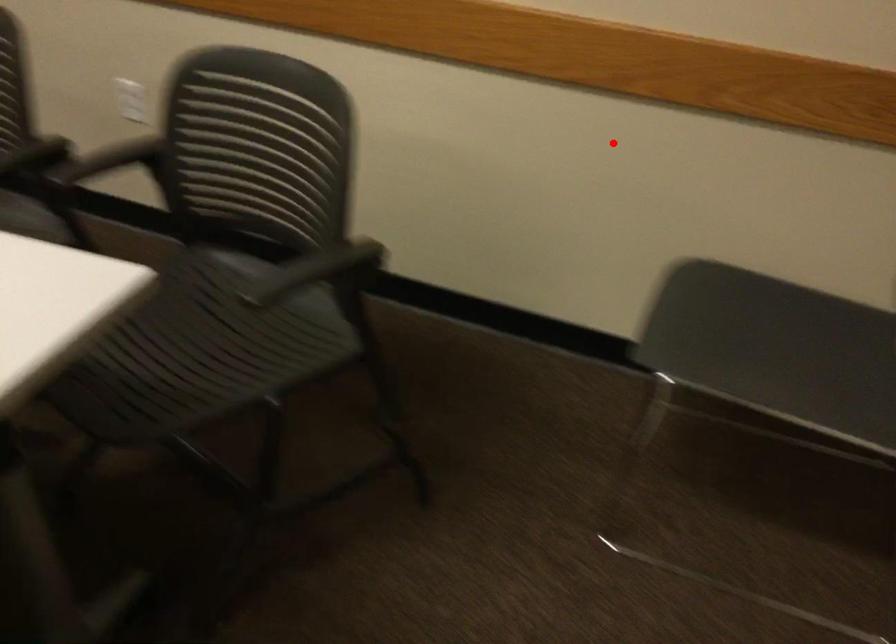
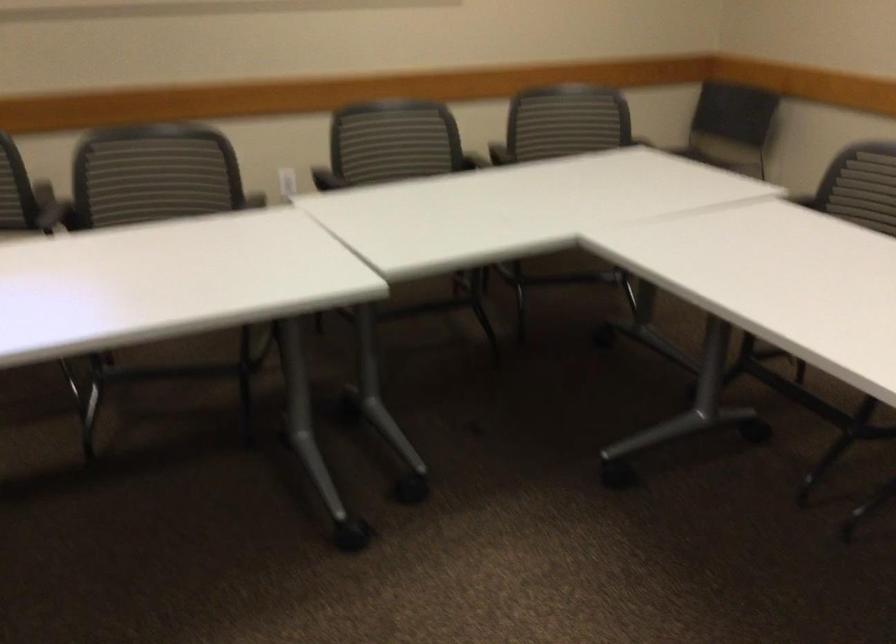
Where in the second image is the point corresponding to the highlighted location from the first image?

(569, 114)